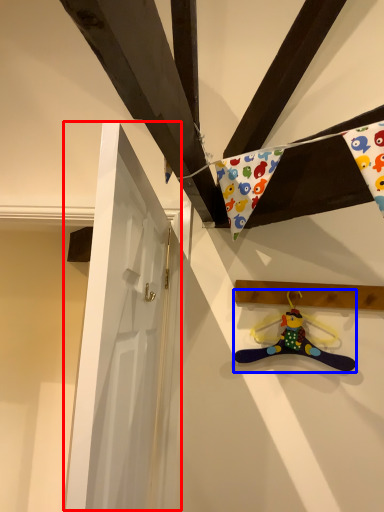
Question: Which point is closer to the camera, door (highlighted by a red box) or toy (highlighted by a blue box)?

Choices:
 (A) door
 (B) toy

Answer: (A)